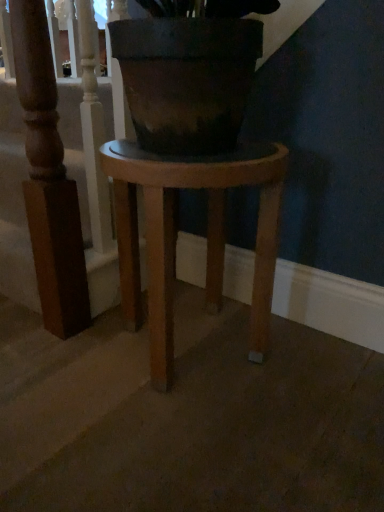
Question: Choose the correct answer: Is wooden baluster at upper left inside wooden stool at center or outside it?

Choices:
 (A) inside
 (B) outside

Answer: (B)

Question: Is wooden baluster at upper left in front of or behind wooden stool at center in the image?

Choices:
 (A) front
 (B) behind

Answer: (B)

Question: In the image, is wooden baluster at upper left on the left side or the right side of wooden stool at center?

Choices:
 (A) left
 (B) right

Answer: (A)

Question: From the image's perspective, relative to wooden baluster at upper left, is wooden stool at center above or below?

Choices:
 (A) below
 (B) above

Answer: (A)

Question: In terms of width, does wooden stool at center look wider or thinner when compared to wooden baluster at upper left?

Choices:
 (A) wide
 (B) thin

Answer: (A)

Question: Is wooden stool at center spatially inside wooden baluster at upper left, or outside of it?

Choices:
 (A) inside
 (B) outside

Answer: (B)

Question: Does point (125, 323) appear closer or farther from the camera than point (49, 172)?

Choices:
 (A) closer
 (B) farther

Answer: (B)